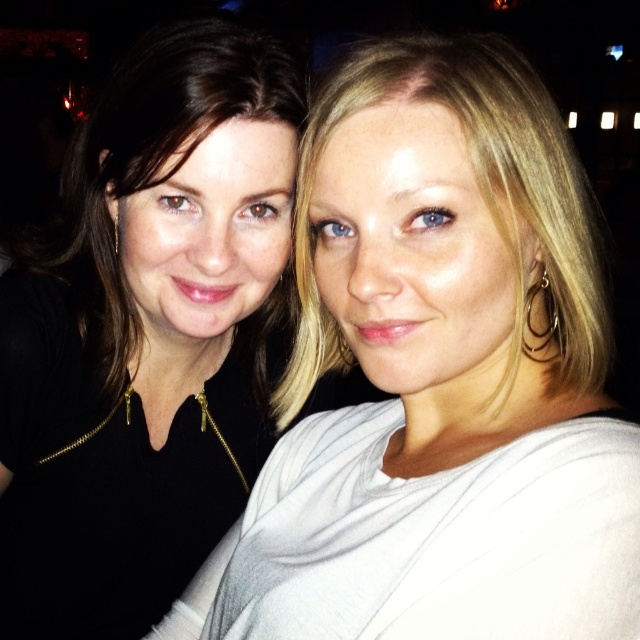
Question: In this image, where is white matte shirt at upper right located relative to matte black top at upper left?

Choices:
 (A) above
 (B) below

Answer: (B)

Question: In this image, where is white matte shirt at upper right located relative to matte black top at upper left?

Choices:
 (A) above
 (B) below

Answer: (B)

Question: Which point appears closest to the camera in this image?

Choices:
 (A) pyautogui.click(x=268, y=90)
 (B) pyautogui.click(x=497, y=474)

Answer: (B)

Question: Which of the following is the closest to the observer?

Choices:
 (A) white matte shirt at upper right
 (B) matte black top at left

Answer: (B)

Question: Is matte black top at left wider than matte black top at upper left?

Choices:
 (A) yes
 (B) no

Answer: (A)

Question: Estimate the real-world distances between objects in this image. Which object is farther from the white matte shirt at upper right?

Choices:
 (A) matte black top at upper left
 (B) matte black top at left

Answer: (A)